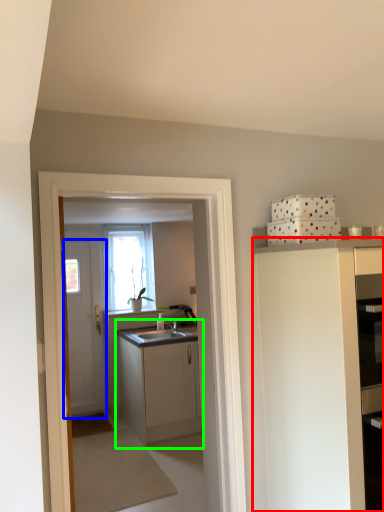
Question: Which is farther away from cabinetry (highlighted by a red box)? door (highlighted by a blue box) or cabinetry (highlighted by a green box)?

Choices:
 (A) door
 (B) cabinetry

Answer: (A)